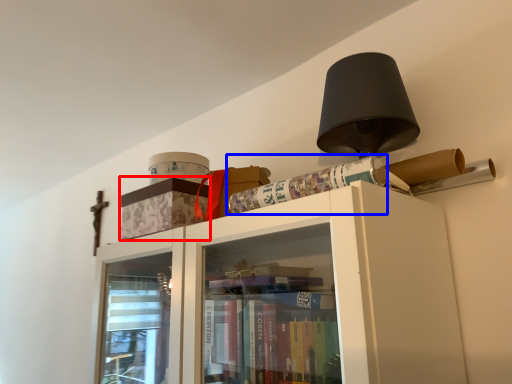
Question: Which object appears closest to the camera in this image, cabinetry (highlighted by a red box) or paperback book (highlighted by a blue box)?

Choices:
 (A) cabinetry
 (B) paperback book

Answer: (B)